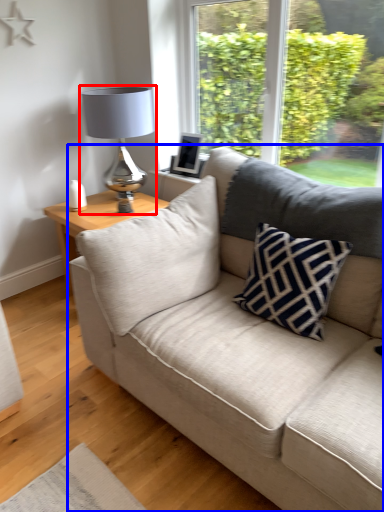
Question: Among these objects, which one is farthest to the camera, table lamp (highlighted by a red box) or studio couch (highlighted by a blue box)?

Choices:
 (A) table lamp
 (B) studio couch

Answer: (A)